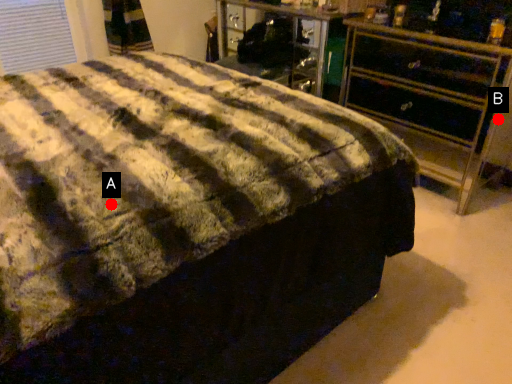
Question: Two points are circled on the image, labeled by A and B beside each circle. Which point is closer to the camera?

Choices:
 (A) A is closer
 (B) B is closer

Answer: (A)